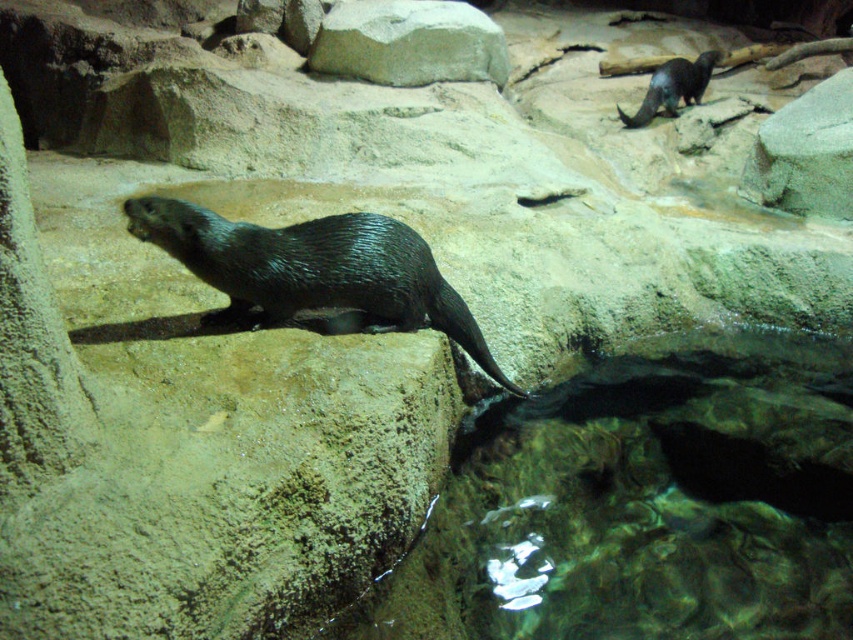
Question: Which object is positioned closest to the shiny black otter at center?

Choices:
 (A) gray stone boulder at upper center
 (B) shiny black beaver at upper right

Answer: (A)

Question: Which point is closer to the camera taking this photo?

Choices:
 (A) (456, 336)
 (B) (647, 113)

Answer: (A)

Question: Can you confirm if shiny black otter at center is positioned to the right of shiny black beaver at upper right?

Choices:
 (A) no
 (B) yes

Answer: (A)

Question: Does shiny black otter at center appear on the left side of gray stone boulder at upper center?

Choices:
 (A) yes
 (B) no

Answer: (A)

Question: From the image, what is the correct spatial relationship of shiny black otter at center in relation to gray stone boulder at upper center?

Choices:
 (A) right
 (B) left

Answer: (B)

Question: Among these points, which one is nearest to the camera?

Choices:
 (A) (408, 42)
 (B) (666, 80)

Answer: (A)